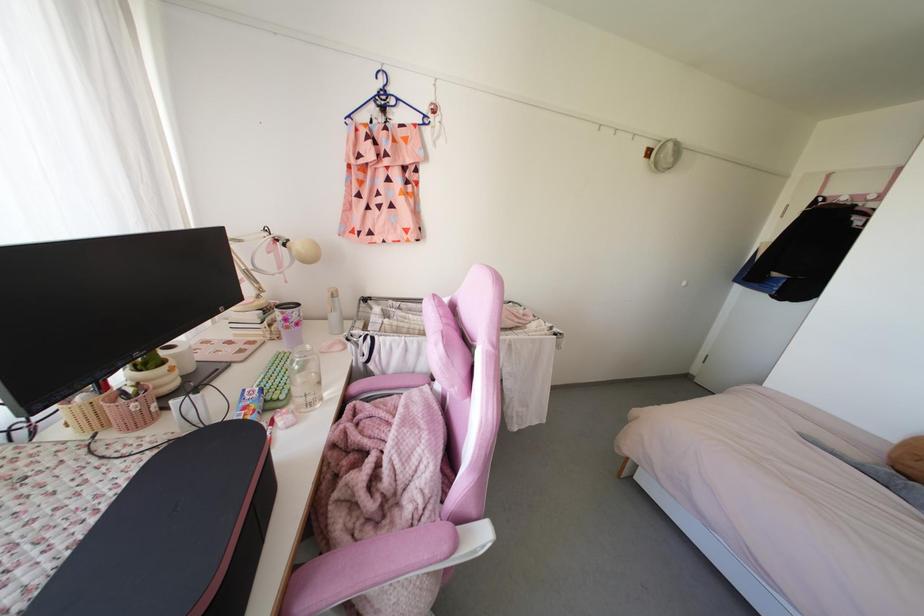
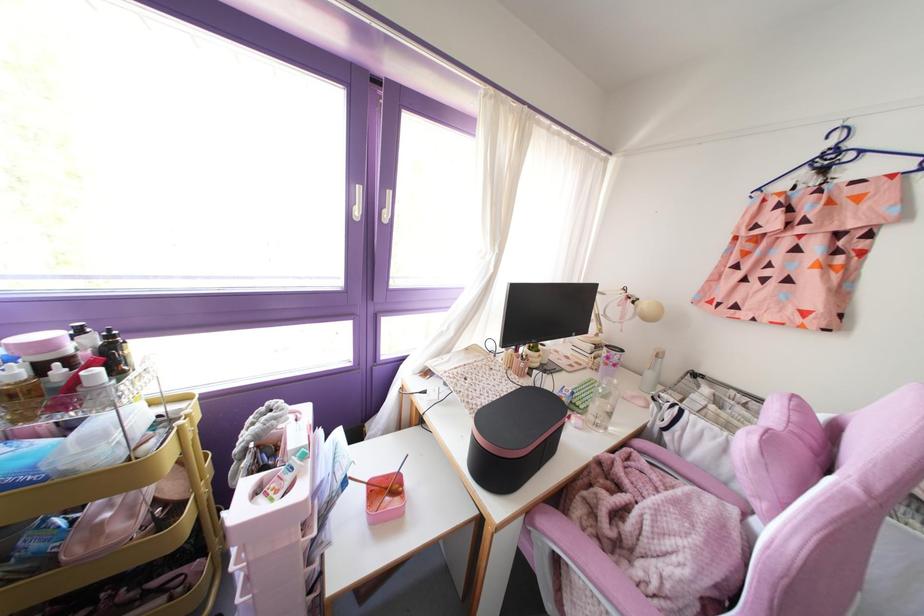
In the second image, find the point that corresponds to (307,346) in the first image.

(614, 381)